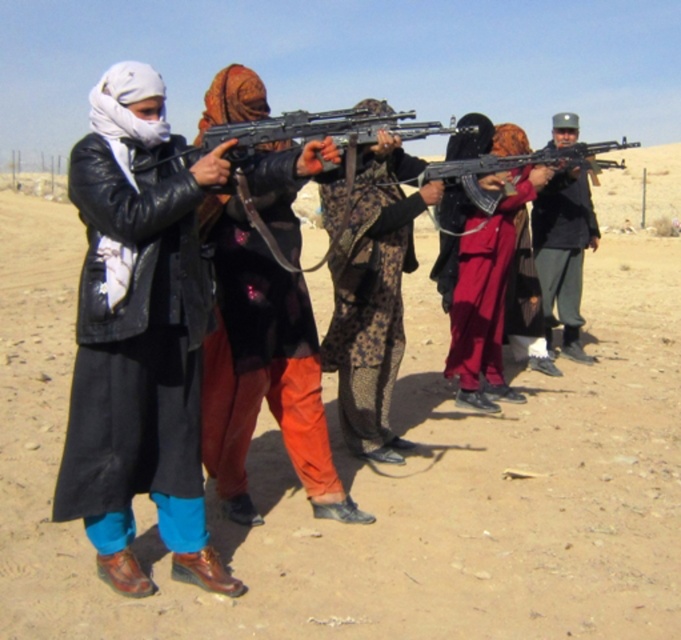
Question: Among these points, which one is nearest to the camera?

Choices:
 (A) (506, 212)
 (B) (311, 492)
 (C) (379, 244)

Answer: (B)

Question: Is leather jacket at left closer to camera compared to patterned fabric dress at center?

Choices:
 (A) yes
 (B) no

Answer: (A)

Question: Is the position of patterned fabric dress at center less distant than that of maroon fabric dress at center?

Choices:
 (A) yes
 (B) no

Answer: (A)

Question: Which of the following is the closest to the observer?

Choices:
 (A) maroon fabric dress at center
 (B) dark gray uniform at center

Answer: (A)

Question: Is leather jacket at left behind maroon fabric dress at center?

Choices:
 (A) yes
 (B) no

Answer: (B)

Question: Which object appears closest to the camera in this image?

Choices:
 (A) patterned fabric dress at center
 (B) dark gray uniform at center
 (C) maroon fabric dress at center

Answer: (A)